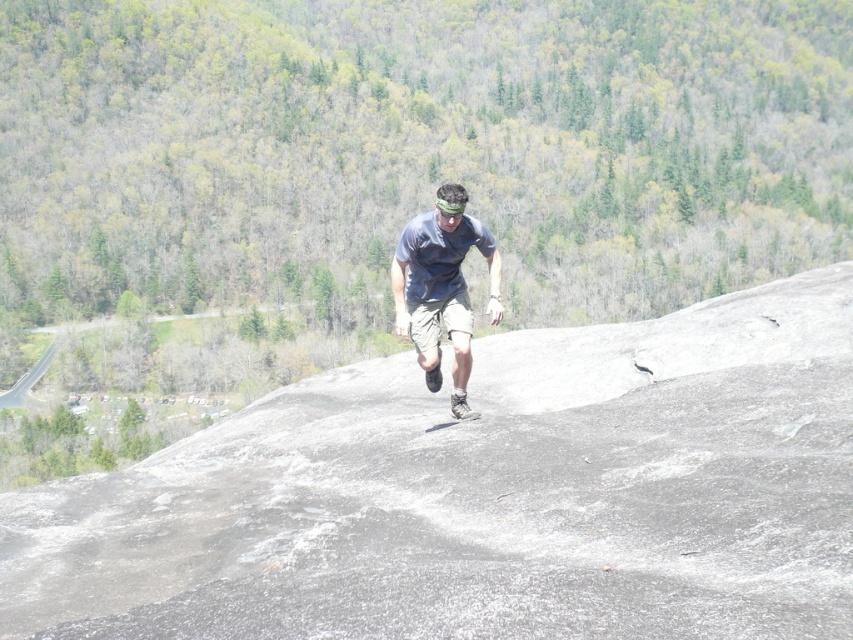
Question: Does gray rock at center have a lesser width compared to matte blue shirt at center?

Choices:
 (A) no
 (B) yes

Answer: (A)

Question: Is gray rock at center below matte blue shirt at center?

Choices:
 (A) yes
 (B) no

Answer: (A)

Question: Which point appears farthest from the camera in this image?

Choices:
 (A) (485, 625)
 (B) (425, 294)

Answer: (B)

Question: Among these objects, which one is nearest to the camera?

Choices:
 (A) matte blue shirt at center
 (B) gray rock at center

Answer: (B)

Question: Can you confirm if gray rock at center is positioned above matte blue shirt at center?

Choices:
 (A) yes
 (B) no

Answer: (B)